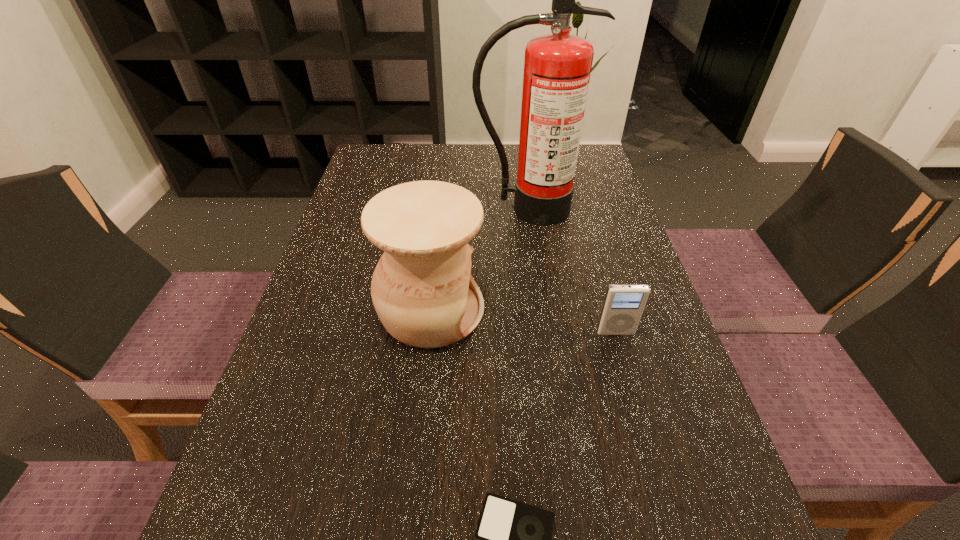
Locate an element on the screen. Image resolution: width=960 pixels, height=540 pixels. the tallest object is located at coordinates (557, 67).

Image resolution: width=960 pixels, height=540 pixels. What are the coordinates of `the farthest object` in the screenshot? It's located at (557, 67).

Find the location of `pottery`. pottery is located at coordinates (422, 289).

Where is `the taller iPod`? The height and width of the screenshot is (540, 960). the taller iPod is located at coordinates (623, 306).

You are a GUI agent. You are given a task and a screenshot of the screen. Output one action in this format:
    pyautogui.click(x=<x>, y=<y>)
    Task: Click on the farther iPod
    The width and height of the screenshot is (960, 540).
    Given the screenshot: What is the action you would take?
    pyautogui.click(x=623, y=306)

The width and height of the screenshot is (960, 540). What are the coordinates of `free space located 0.390m on the front-facing side of the tallest object` in the screenshot? It's located at (547, 350).

Locate an element on the screen. The width and height of the screenshot is (960, 540). vacant region located 0.050m at the open side of the pottery is located at coordinates (509, 310).

Where is `vacant space located 0.170m on the front-facing side of the right iPod`? vacant space located 0.170m on the front-facing side of the right iPod is located at coordinates (639, 417).

You are a GUI agent. You are given a task and a screenshot of the screen. Output one action in this format:
    pyautogui.click(x=<x>, y=<y>)
    Task: Click on the object that is positioned at the left edge
    The image size is (960, 540).
    Given the screenshot: What is the action you would take?
    pyautogui.click(x=422, y=289)

At what (x,y) coordinates should I click in order to perform the action: click on fire extinguisher located in the right edge section of the desktop. Please return your answer as a coordinate pair (x, y). Looking at the image, I should click on (557, 67).